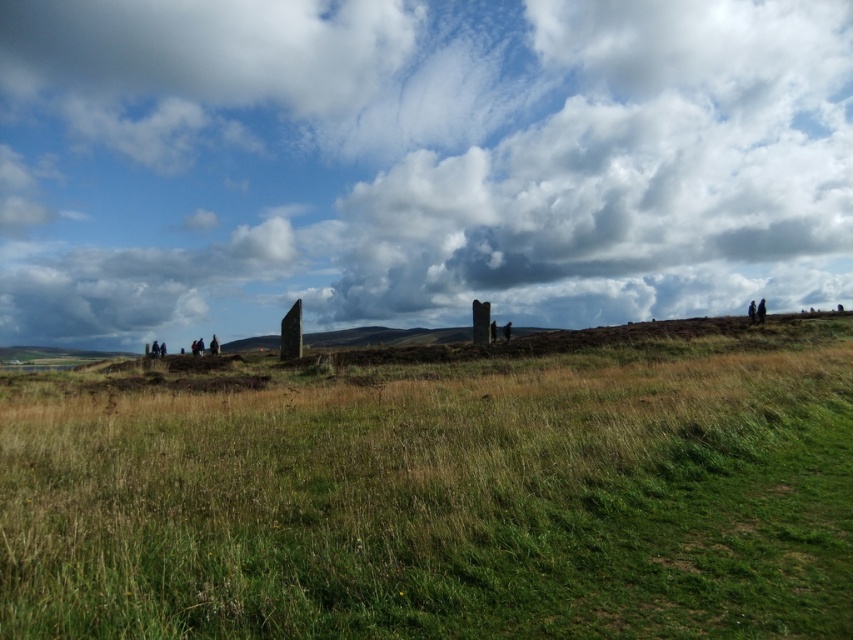
Which is behind, point (585, 252) or point (119, 520)?

Positioned behind is point (585, 252).

Who is positioned more to the left, cloudy sky at upper center or green grassy field at center?

Positioned to the left is cloudy sky at upper center.

Between point (22, 132) and point (395, 400), which one is positioned behind?

The point (22, 132) is behind.

The width and height of the screenshot is (853, 640). I want to click on cloudy sky at upper center, so click(416, 163).